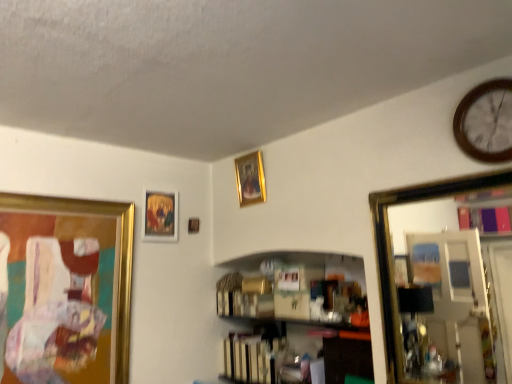
Question: From a real-world perspective, is gold metallic picture frame at left, the 4th picture frame when ordered from right to left, beneath brown wooden clock at upper right?

Choices:
 (A) yes
 (B) no

Answer: (A)

Question: Is gold metallic picture frame at left, the 1th picture frame from the left, at the left side of brown wooden clock at upper right?

Choices:
 (A) no
 (B) yes

Answer: (B)

Question: Is gold metallic picture frame at left, the 1th picture frame from the left, to the right of brown wooden clock at upper right from the viewer's perspective?

Choices:
 (A) no
 (B) yes

Answer: (A)

Question: Would you say brown wooden clock at upper right is part of gold metallic picture frame at left, the 1th picture frame from the left,'s contents?

Choices:
 (A) yes
 (B) no

Answer: (B)

Question: Is gold metallic picture frame at left, the 1th picture frame from the left, turned away from brown wooden clock at upper right?

Choices:
 (A) yes
 (B) no

Answer: (B)

Question: Does gold metallic picture frame at left, the 1th picture frame from the left, turn towards brown wooden clock at upper right?

Choices:
 (A) yes
 (B) no

Answer: (A)

Question: Does gold metallic picture frame at left, the 1th picture frame from the left, have a greater height compared to gold metallic picture frame at upper center, positioned as the 4th picture frame in left-to-right order?

Choices:
 (A) no
 (B) yes

Answer: (B)

Question: Is gold metallic picture frame at left, the 4th picture frame when ordered from right to left, positioned in front of gold metallic picture frame at upper center, positioned as the 4th picture frame in left-to-right order?

Choices:
 (A) no
 (B) yes

Answer: (B)

Question: Can you confirm if gold metallic picture frame at left, the 1th picture frame from the left, is bigger than gold metallic picture frame at upper center, positioned as the 4th picture frame in left-to-right order?

Choices:
 (A) yes
 (B) no

Answer: (A)

Question: Is gold metallic picture frame at left, the 4th picture frame when ordered from right to left, placed right next to gold metallic picture frame at upper center, positioned as the 4th picture frame in left-to-right order?

Choices:
 (A) no
 (B) yes

Answer: (A)

Question: Considering the relative positions of gold metallic picture frame at left, the 1th picture frame from the left, and gold metallic picture frame at upper center, which is the 1th picture frame in right-to-left order, in the image provided, is gold metallic picture frame at left, the 1th picture frame from the left, behind gold metallic picture frame at upper center, which is the 1th picture frame in right-to-left order,?

Choices:
 (A) no
 (B) yes

Answer: (A)

Question: Is gold metallic picture frame at left, the 4th picture frame when ordered from right to left, to the right of gold metallic picture frame at upper center, positioned as the 4th picture frame in left-to-right order, from the viewer's perspective?

Choices:
 (A) yes
 (B) no

Answer: (B)

Question: Would you say wooden picture frame at upper center, marked as the third picture frame in a left-to-right arrangement, contains gold-framed mirror at right?

Choices:
 (A) no
 (B) yes

Answer: (A)